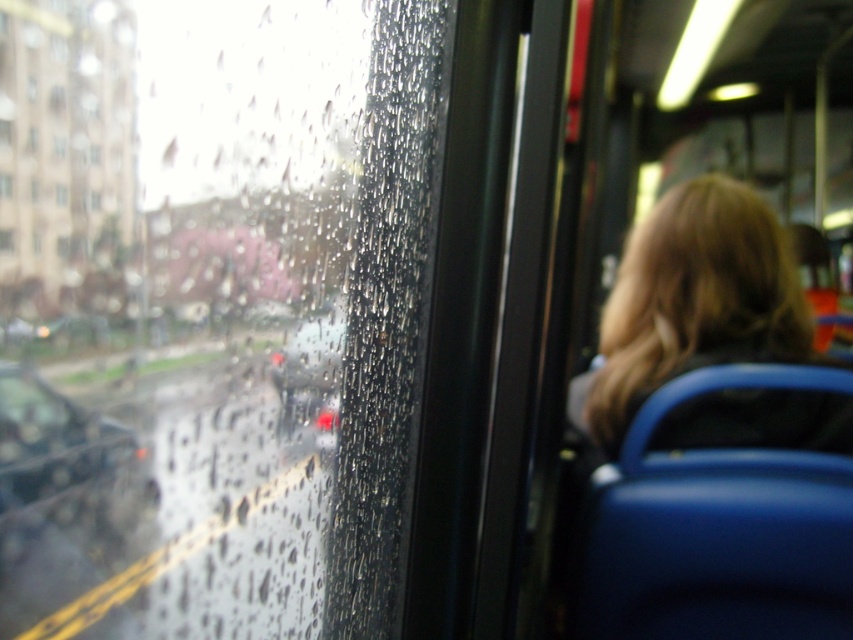
You are a delivery person who needs to exit the bus quickly. You see the metallic gray car at left and the transparent glass window at left. Can you step out safely through the space between them?

The space between the metallic gray car at left and transparent glass window at left is 3.25 inches, which is too narrow for a person to step through safely. You should find another exit.